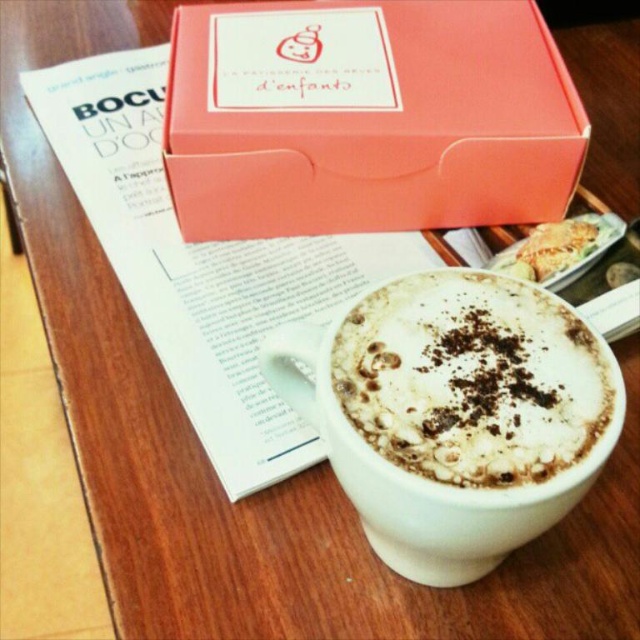
Question: Among these points, which one is farthest from the camera?

Choices:
 (A) (488, 177)
 (B) (419, 416)

Answer: (A)

Question: Which point is farther from the camera taking this photo?

Choices:
 (A) (525, 259)
 (B) (296, 56)

Answer: (B)

Question: Does pink cardboard box at upper center have a larger size compared to golden crispy pastry at upper right?

Choices:
 (A) no
 (B) yes

Answer: (B)

Question: Is white frothy coffee at center to the right of golden crispy pastry at upper right from the viewer's perspective?

Choices:
 (A) no
 (B) yes

Answer: (A)

Question: Which object appears closest to the camera in this image?

Choices:
 (A) white frothy coffee at center
 (B) pink cardboard box at upper center

Answer: (A)

Question: Does white frothy coffee at center appear under golden crispy pastry at upper right?

Choices:
 (A) no
 (B) yes

Answer: (B)